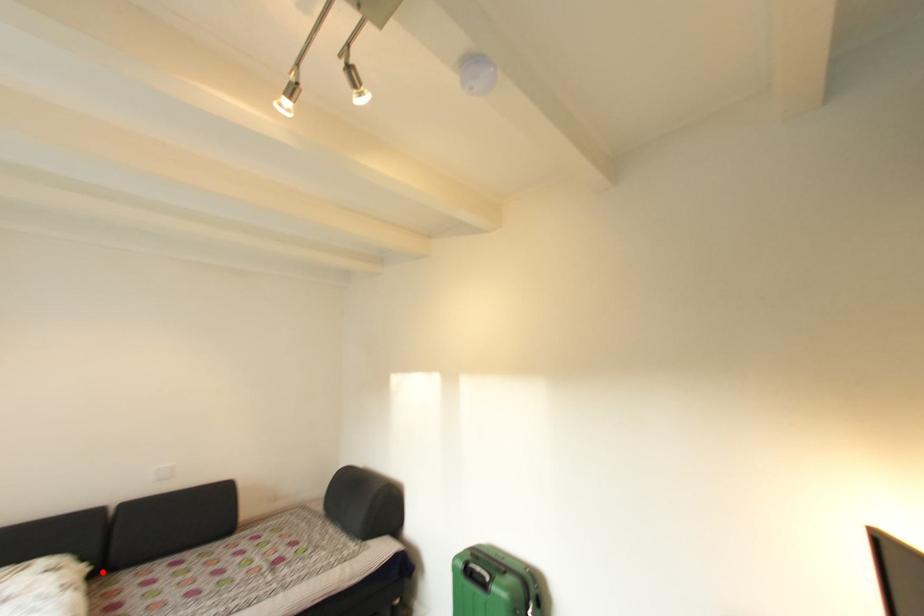
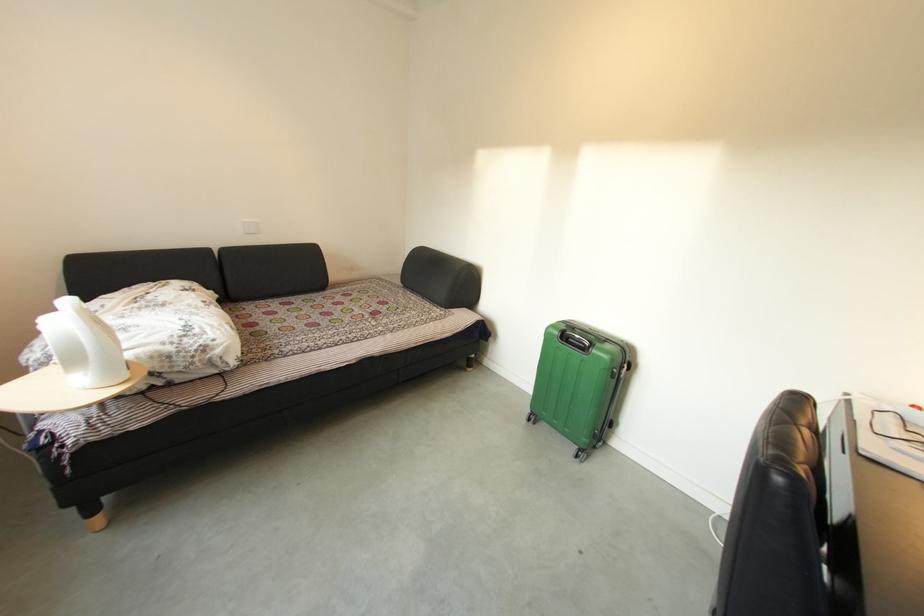
Locate, in the second image, the point that corresponds to the highlighted location in the first image.

(228, 300)